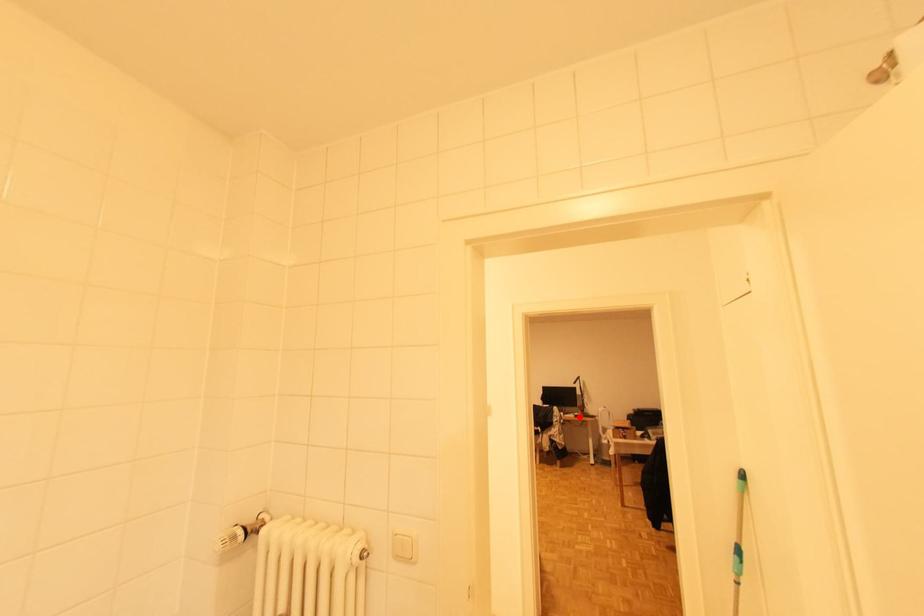
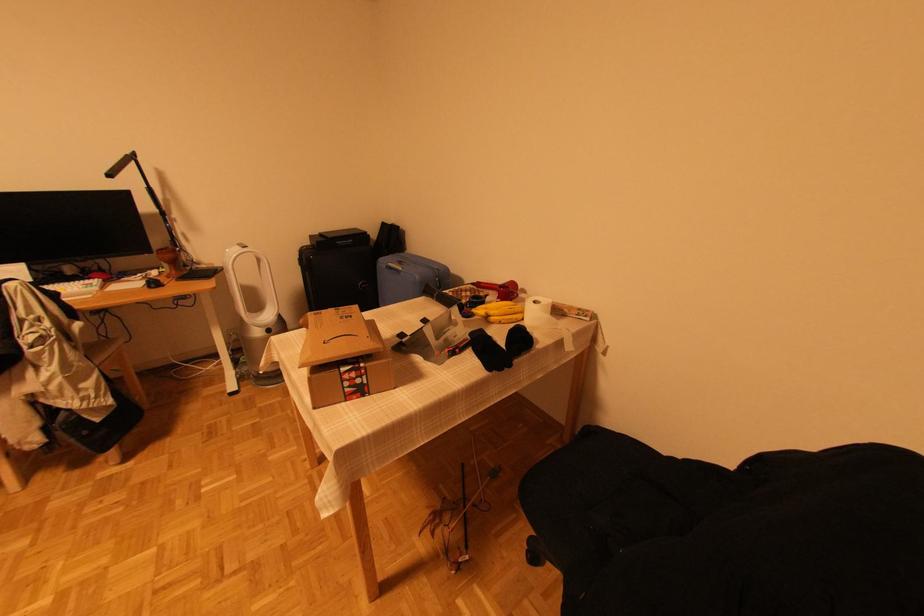
Question: I am providing you with two images of the same scene from different viewpoints. Image1 has a red point marked. In image2, the corresponding 3D location appears at what relative position? Reply with the corresponding letter.

Choices:
 (A) Closer
 (B) Farther

Answer: (A)